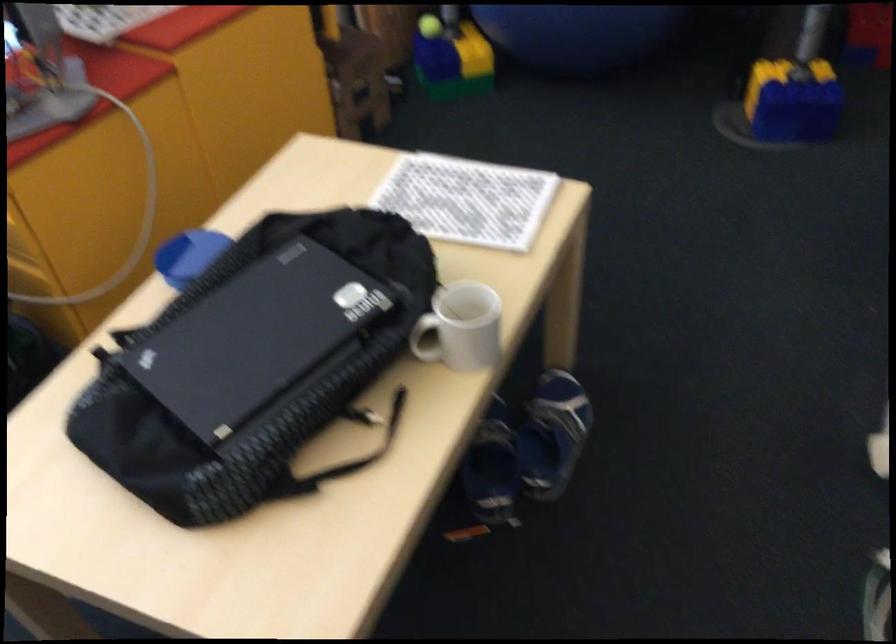
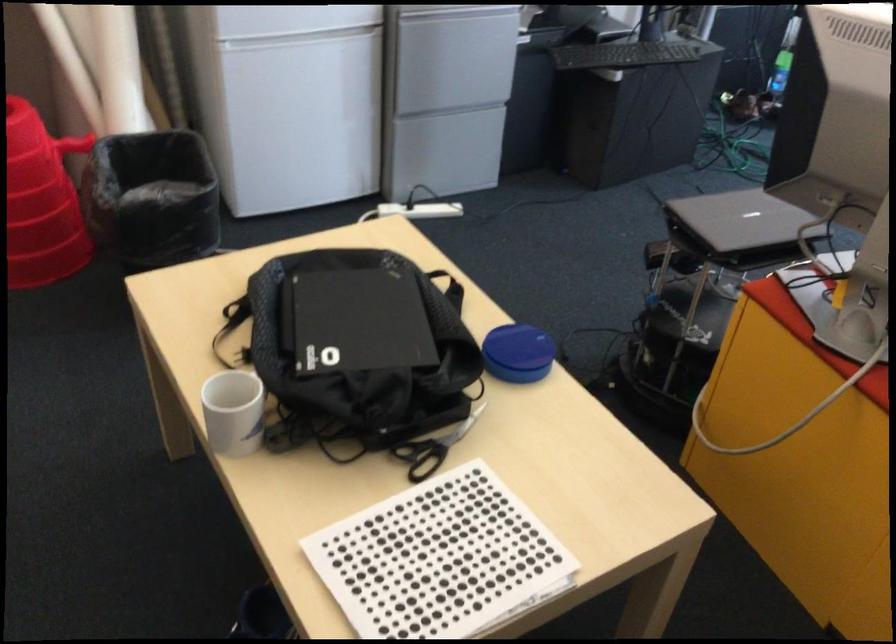
The point at (471, 204) is marked in the first image. Where is the corresponding point in the second image?

(440, 560)